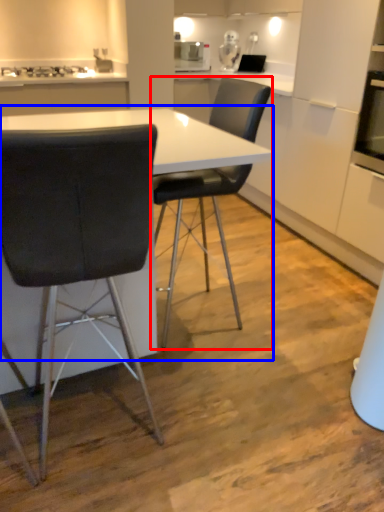
Question: Which object appears farthest to the camera in this image, chair (highlighted by a red box) or table (highlighted by a blue box)?

Choices:
 (A) chair
 (B) table

Answer: (A)